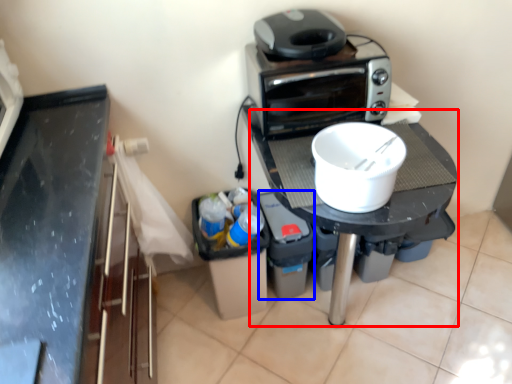
Question: Among these objects, which one is nearest to the camera, table (highlighted by a red box) or appliance (highlighted by a blue box)?

Choices:
 (A) table
 (B) appliance

Answer: (A)